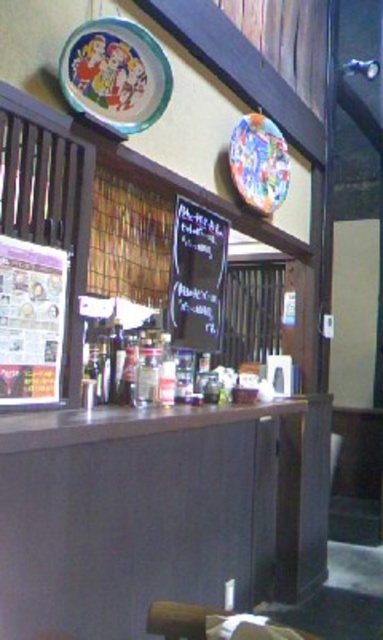
Does matte ceramic plate at upper left have a greater height compared to colorful glossy plate at upper center?

No, matte ceramic plate at upper left is not taller than colorful glossy plate at upper center.

At what (x,y) coordinates should I click in order to perform the action: click on matte ceramic plate at upper left. Please return your answer as a coordinate pair (x, y). Looking at the image, I should click on (114, 74).

Describe the element at coordinates (158, 513) in the screenshot. I see `smooth dark wood table at center` at that location.

Does smooth dark wood table at center appear under colorful glossy plate at upper center?

Correct, smooth dark wood table at center is located below colorful glossy plate at upper center.

Who is more distant from viewer, (x=70, y=577) or (x=234, y=136)?

The point (x=234, y=136) is behind.

Find the location of a particular element. Image resolution: width=383 pixels, height=640 pixels. smooth dark wood table at center is located at coordinates (x=158, y=513).

Which is behind, point (57, 593) or point (176, 218)?

The point (176, 218) is behind.

Is point (178, 477) positioned in front of point (189, 200)?

Yes, point (178, 477) is in front of point (189, 200).

At what (x,y) coordinates should I click in order to perform the action: click on smooth dark wood table at center. Please return your answer as a coordinate pair (x, y). Looking at the image, I should click on (158, 513).

What are the coordinates of `smooth dark wood table at center` in the screenshot? It's located at (158, 513).